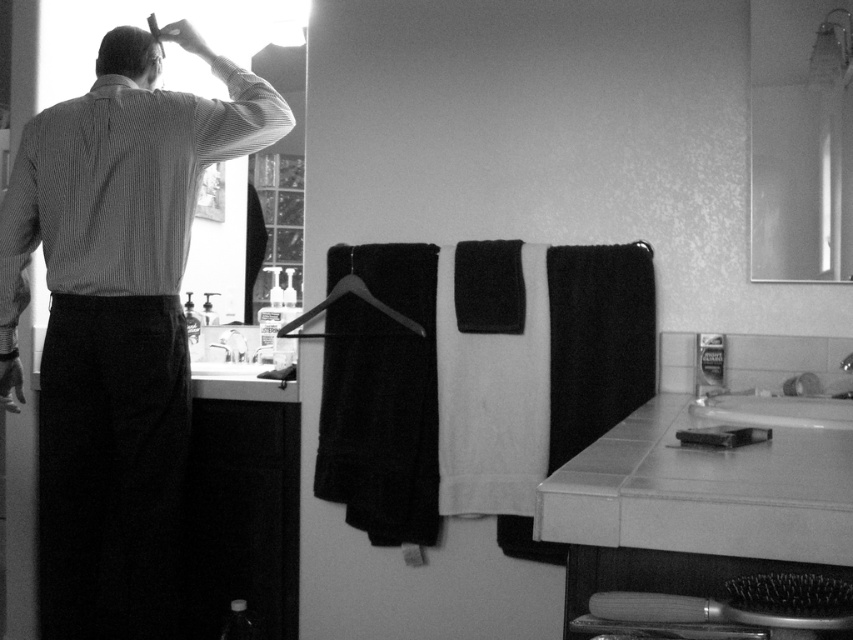
Does dark brown hair at upper left have a greater height compared to metallic silver faucet at sink left?

Yes.

The height and width of the screenshot is (640, 853). What do you see at coordinates (128, 54) in the screenshot? I see `dark brown hair at upper left` at bounding box center [128, 54].

Does point (122, 70) come farther from viewer compared to point (236, 330)?

No, (122, 70) is closer to viewer.

Locate an element on the screen. dark brown hair at upper left is located at coordinates (128, 54).

Does shiny black hairbrush at lower center have a larger size compared to white glossy sink at lower center?

Actually, shiny black hairbrush at lower center might be smaller than white glossy sink at lower center.

You are a GUI agent. You are given a task and a screenshot of the screen. Output one action in this format:
    pyautogui.click(x=<x>, y=<y>)
    Task: Click on the shiny black hairbrush at lower center
    This screenshot has height=640, width=853.
    Given the screenshot: What is the action you would take?
    pyautogui.click(x=740, y=604)

Image resolution: width=853 pixels, height=640 pixels. What are the coordinates of `shiny black hairbrush at lower center` in the screenshot? It's located at (740, 604).

What do you see at coordinates (722, 436) in the screenshot? I see `metallic silver towel bar at lower right` at bounding box center [722, 436].

Can you confirm if metallic silver towel bar at lower right is smaller than metallic silver faucet at sink left?

Incorrect, metallic silver towel bar at lower right is not smaller in size than metallic silver faucet at sink left.

Who is more forward, (698, 432) or (225, 337)?

Point (698, 432) is in front.

You are a GUI agent. You are given a task and a screenshot of the screen. Output one action in this format:
    pyautogui.click(x=<x>, y=<y>)
    Task: Click on the metallic silver towel bar at lower right
    The height and width of the screenshot is (640, 853).
    Given the screenshot: What is the action you would take?
    pyautogui.click(x=722, y=436)